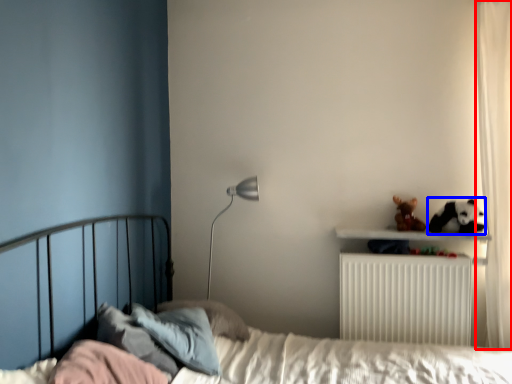
Question: Which point is closer to the camera, curtain (highlighted by a red box) or animal (highlighted by a blue box)?

Choices:
 (A) curtain
 (B) animal

Answer: (A)